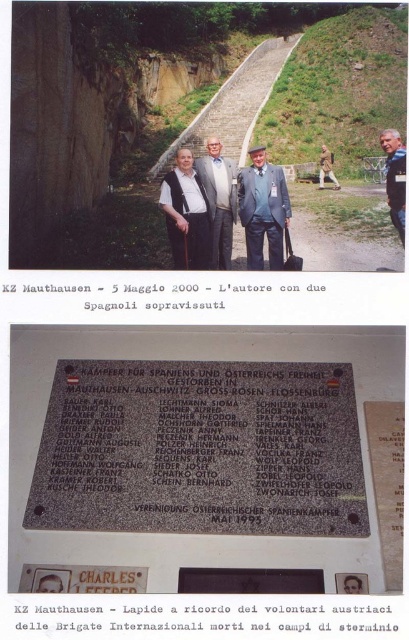
Which is more to the left, gray polished stone plaque at center or khaki fabric jacket at center?

gray polished stone plaque at center

Is gray polished stone plaque at center above khaki fabric jacket at center?

Incorrect, gray polished stone plaque at center is not positioned above khaki fabric jacket at center.

Which is in front, point (112, 362) or point (323, 163)?

Point (112, 362)

Image resolution: width=409 pixels, height=640 pixels. In order to click on gray polished stone plaque at center in this screenshot , I will do `click(200, 449)`.

Is point (206, 611) farther from viewer compared to point (393, 195)?

No, (206, 611) is closer to viewer.

This screenshot has width=409, height=640. Find the location of `black metal plaque at center`. black metal plaque at center is located at coordinates (204, 618).

Where is `black metal plaque at center`? This screenshot has height=640, width=409. black metal plaque at center is located at coordinates pyautogui.click(x=204, y=618).

Does point (343, 477) lie behind point (161, 608)?

Yes.

Can you confirm if gray polished stone plaque at center is positioned to the left of black metal plaque at center?

Indeed, gray polished stone plaque at center is positioned on the left side of black metal plaque at center.

Which is behind, point (247, 384) or point (53, 616)?

The point (247, 384) is behind.

Image resolution: width=409 pixels, height=640 pixels. Identify the location of gray polished stone plaque at center. (200, 449).